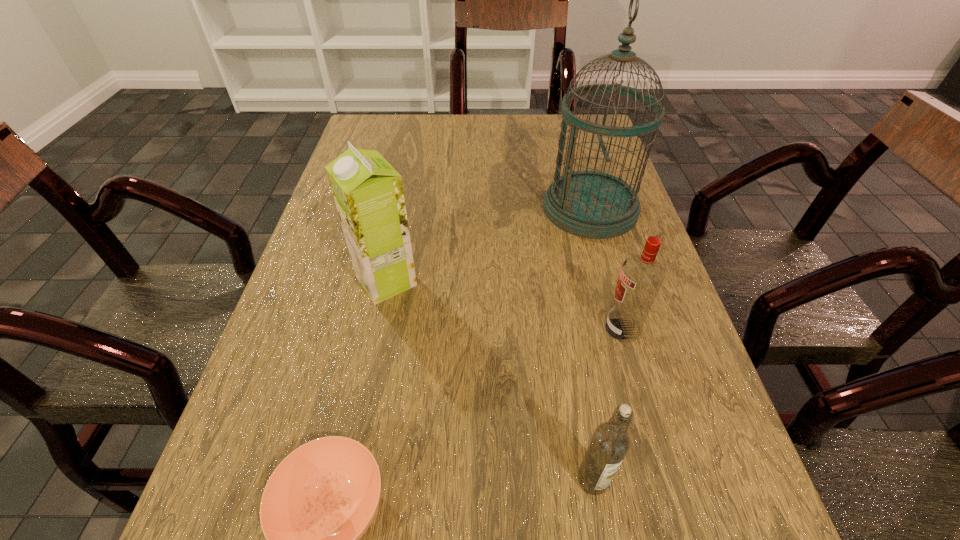
Locate an element on the screen. free space that satisfies the following two spatial constraints: 1. on the front label of the right vodka; 2. on the label of the nearer vodka is located at coordinates (664, 480).